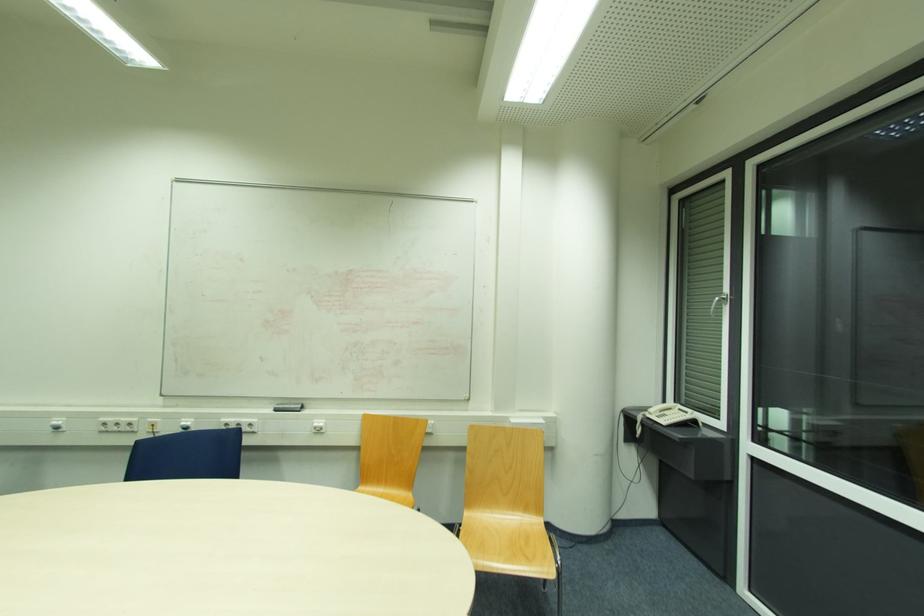
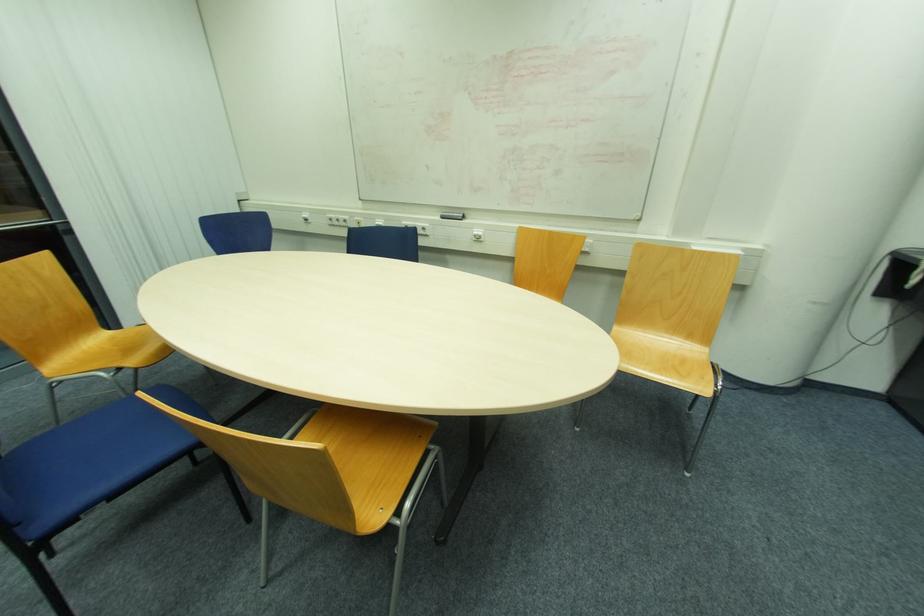
Where in the second image is the point corresponding to (x=317, y=424) from the first image?

(477, 233)